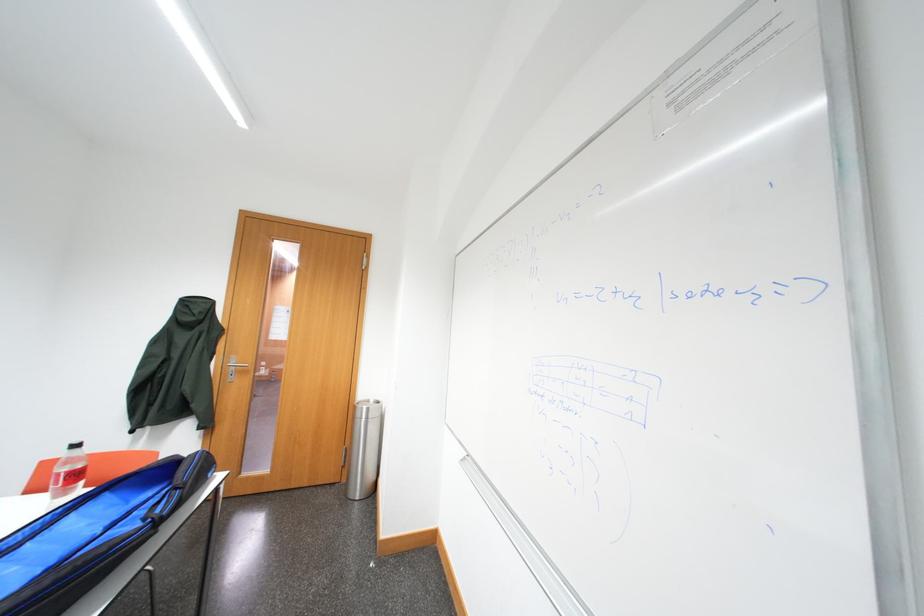
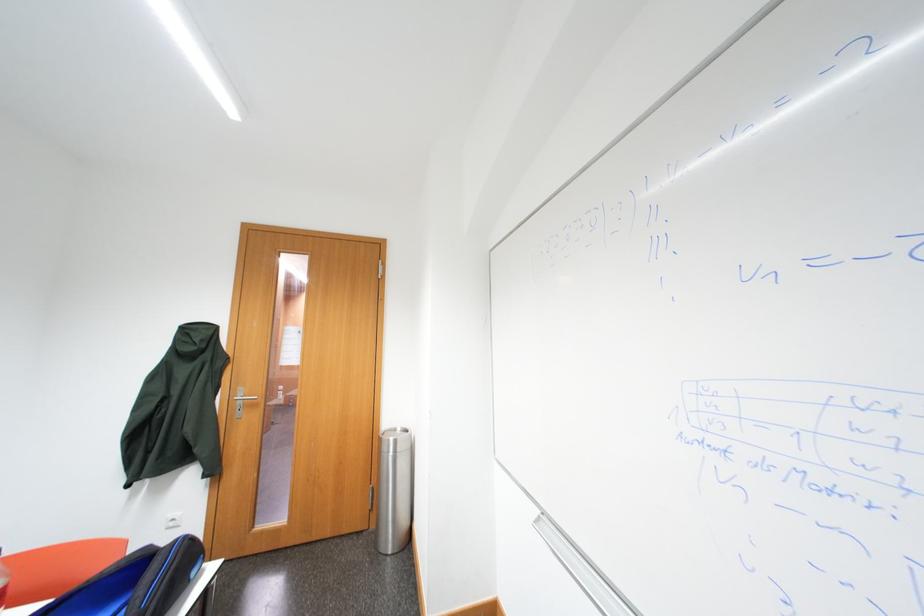
Which direction would the cameraman need to move to produce the second image?

The movement direction of the cameraman is left, forward.